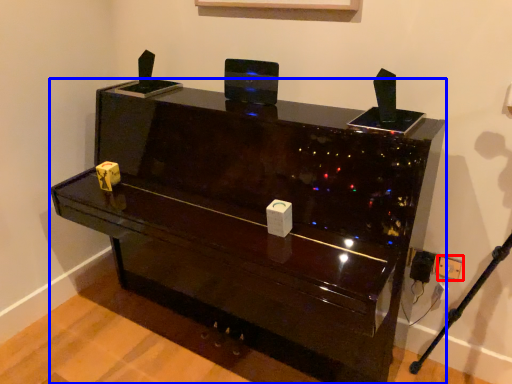
Question: Which object appears farthest to the camera in this image, electric outlet (highlighted by a red box) or furniture (highlighted by a blue box)?

Choices:
 (A) electric outlet
 (B) furniture

Answer: (A)